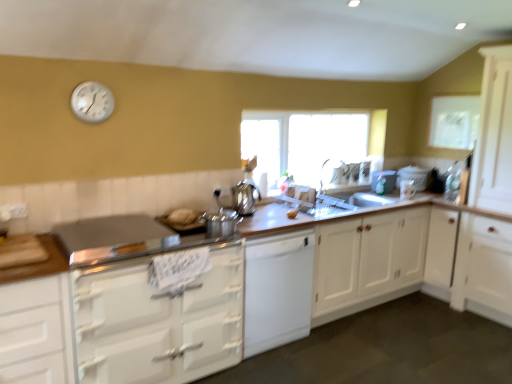
Question: From a real-world perspective, is white paper at upper right above or below satin silver kettle at center?

Choices:
 (A) below
 (B) above

Answer: (B)

Question: Is white paper at upper right spatially inside satin silver kettle at center, or outside of it?

Choices:
 (A) inside
 (B) outside

Answer: (B)

Question: Which is farther from the metallic silver pot at center, the 3th appliance in the right-to-left sequence?

Choices:
 (A) white matte dishwasher at center, marked as the third cabinetry in a right-to-left arrangement
 (B) white wood cabinets at center, the 3th cabinetry in the left-to-right sequence
 (C) white wood cabinet at center, acting as the fourth cabinetry starting from the left
 (D) white glossy cabinet at lower left, which appears as the 1th cabinetry when viewed from the left
 (E) white paper at upper right

Answer: (E)

Question: Which object is the closest to the white wood cabinet at center, acting as the fourth cabinetry starting from the left?

Choices:
 (A) white wood cabinets at center, the second cabinetry positioned from the right
 (B) silver metallic clock at upper left
 (C) metallic silver pot at center, arranged as the first appliance when viewed from the front
 (D) white glossy cabinet at lower left, marked as the 4th cabinetry in a right-to-left arrangement
 (E) satin silver kettle at center

Answer: (A)